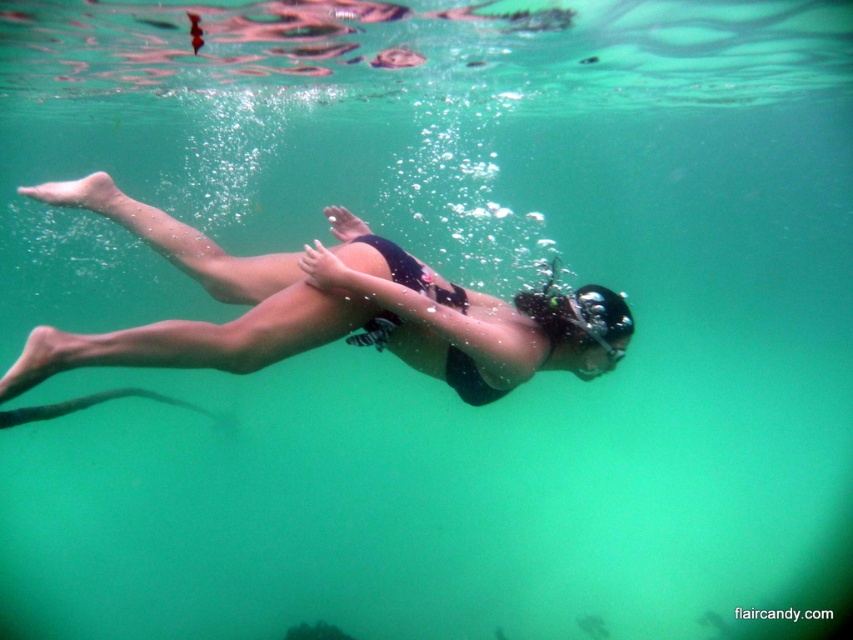
Does black matte swimsuit at center appear under transparent rubber goggles at center?

Incorrect, black matte swimsuit at center is not positioned below transparent rubber goggles at center.

Does black matte swimsuit at center come in front of transparent rubber goggles at center?

Yes, it is in front of transparent rubber goggles at center.

Where is `black matte swimsuit at center`? black matte swimsuit at center is located at coordinates (x=310, y=308).

Find the location of `black matte swimsuit at center`. black matte swimsuit at center is located at coordinates (310, 308).